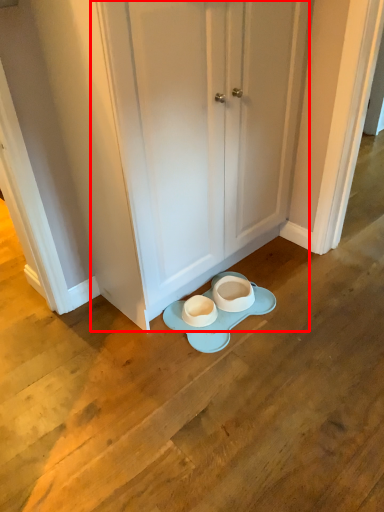
Question: Where is door (annotated by the red box) located in relation to porcelain in the image?

Choices:
 (A) right
 (B) left

Answer: (A)